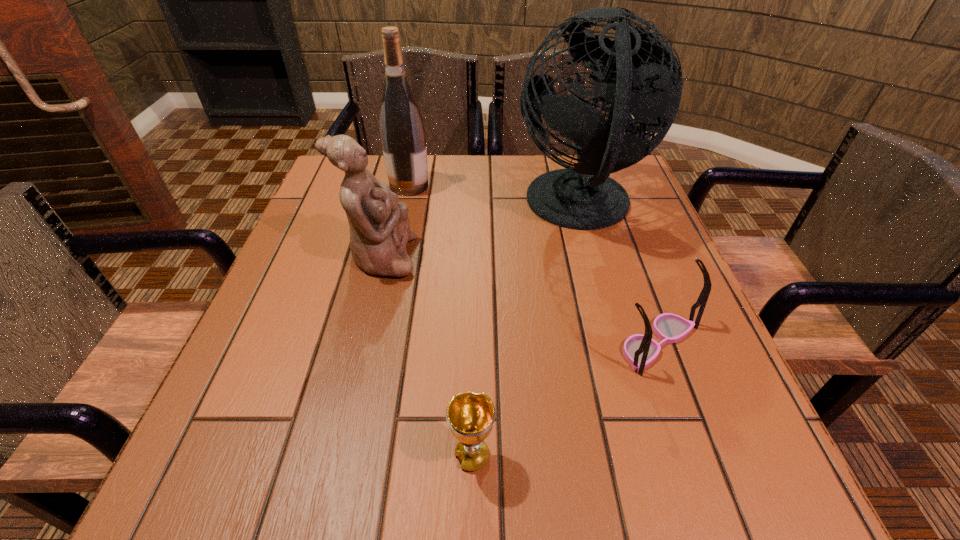
What are the coordinates of `globe` in the screenshot? It's located at (633, 72).

You are a GUI agent. You are given a task and a screenshot of the screen. Output one action in this format:
    pyautogui.click(x=<x>, y=<y>)
    Task: Click on the wine bottle
    The height and width of the screenshot is (540, 960).
    Given the screenshot: What is the action you would take?
    pyautogui.click(x=402, y=131)

This screenshot has height=540, width=960. Identify the location of the third tallest object. point(379,226).

Locate an element on the screen. the second nearest object is located at coordinates (640, 351).

You are a GUI agent. You are given a task and a screenshot of the screen. Output one action in this format:
    pyautogui.click(x=<x>, y=<y>)
    Task: Click on the nearest object
    The image size is (960, 540).
    Given the screenshot: What is the action you would take?
    pyautogui.click(x=470, y=416)

Locate an element on the screen. The image size is (960, 540). chalice is located at coordinates (470, 416).

Locate an element on the screen. Image resolution: width=960 pixels, height=540 pixels. free location located 0.260m on the front-facing side of the globe is located at coordinates (408, 207).

Image resolution: width=960 pixels, height=540 pixels. I want to click on vacant point located 0.300m on the front-facing side of the globe, so click(x=392, y=207).

Find the location of `vacant area situated 0.200m on the front-facing side of the globe`. vacant area situated 0.200m on the front-facing side of the globe is located at coordinates (432, 207).

In order to click on vacant region located on the label of the wine bottle in this screenshot , I will do `click(495, 186)`.